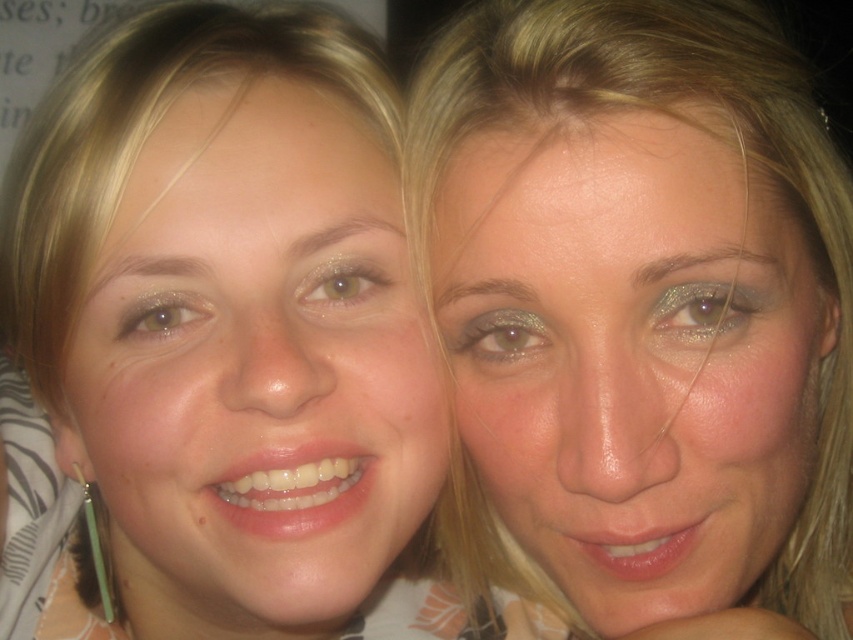
You are a photographer trying to capture a closeup shot of the smooth skin face at center. The camera you are using has a minimum focusing distance of 12 inches. Will you be able to take a clear photo without blurring?

The distance between the smooth skin face at center and the camera is 15.03 inches, which is greater than the camera minimum focusing distance of 12 inches. Therefore, you can take a clear photo without blurring.

You are a photographer using a camera with a 3.5 inch lens. You want to take a portrait of both the smooth skin face at center and the matte skin face at center in the image. Can the lens capture both faces in one shot without zooming in?

The smooth skin face at center and matte skin face at center are 4.50 inches apart from each other. Since the lens is only 3.5 inches wide, it cannot capture both faces in one shot without zooming in.